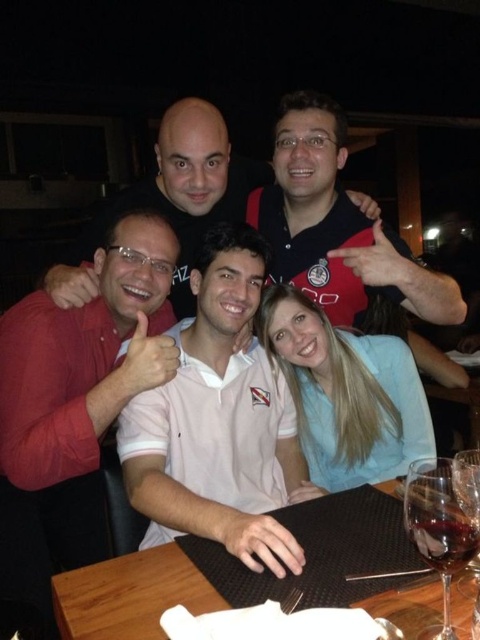
You are a photographer taking a picture of the group at the table. You want to include both the transparent glass wine at lower right and the camera in the frame. What is the minimum distance you need to step back to ensure both objects are in the shot?

The transparent glass wine at lower right and camera are 25.33 inches apart, so the photographer needs to step back at least 25.33 inches to ensure both objects are in the frame.

You are a bartender preparing drinks for a group at the table. You need to choose a glass that can hold more liquid. Which one should you select between the transparent glass wine at lower right and the transparent glass at table center?

The transparent glass wine at lower right has a greater width than the transparent glass at table center, so it can hold more liquid.